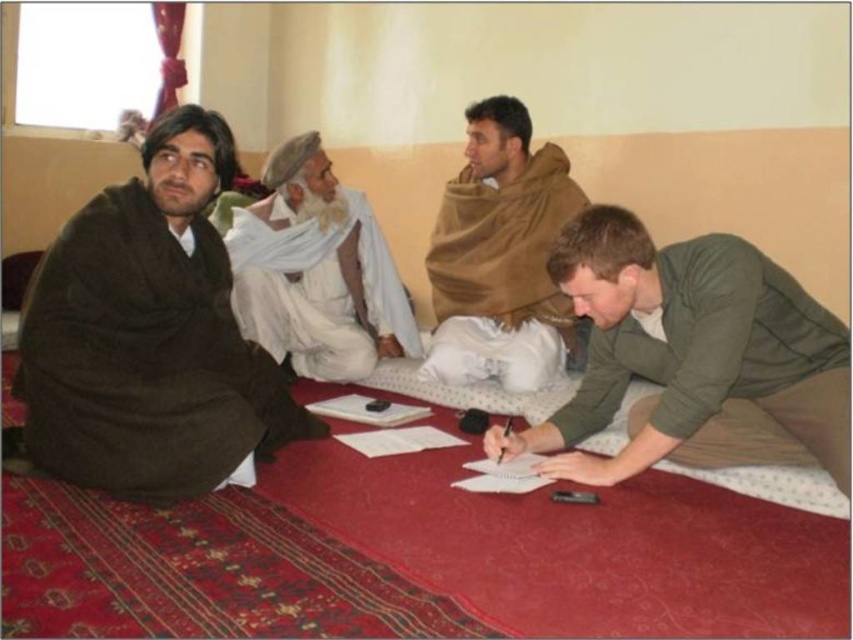
Question: Does brown woolen robe at left appear under white cotton turban at center?

Choices:
 (A) yes
 (B) no

Answer: (A)

Question: Which point is farther to the camera?

Choices:
 (A) white cotton turban at center
 (B) brown woolen shawl at upper center

Answer: (A)

Question: Which object is positioned farthest from the green matte shirt at lower right?

Choices:
 (A) brown woolen robe at left
 (B) brown woolen shawl at upper center
 (C) white cotton turban at center

Answer: (C)

Question: Can you confirm if brown woolen shawl at upper center is wider than white cotton turban at center?

Choices:
 (A) no
 (B) yes

Answer: (A)

Question: Is brown woolen robe at left to the right of green matte shirt at lower right from the viewer's perspective?

Choices:
 (A) yes
 (B) no

Answer: (B)

Question: Which object appears farthest from the camera in this image?

Choices:
 (A) brown woolen robe at left
 (B) brown woolen shawl at upper center
 (C) white cotton turban at center

Answer: (C)